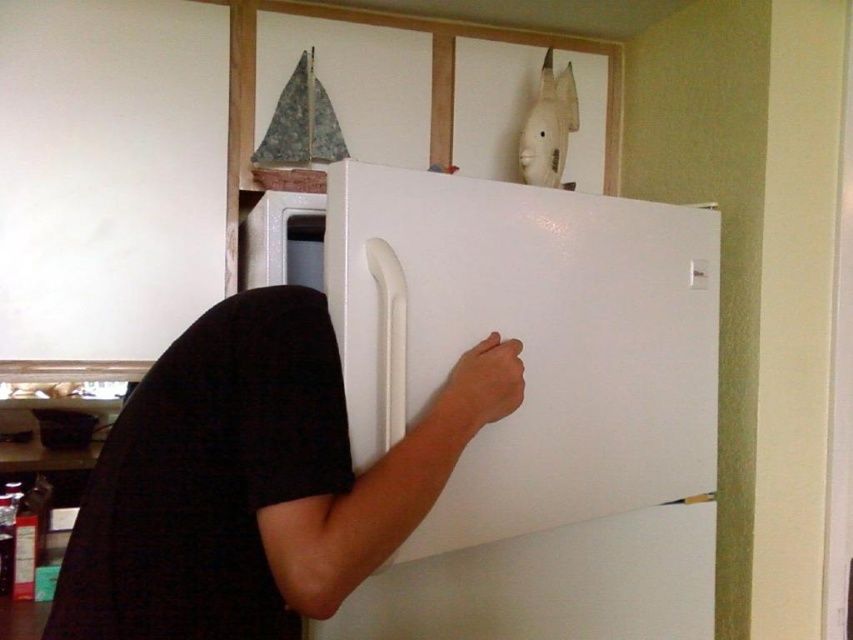
Consider the image. Which is below, white glossy refrigerator at center or black matte shirt at center?

black matte shirt at center is below.

What do you see at coordinates (534, 403) in the screenshot? The width and height of the screenshot is (853, 640). I see `white glossy refrigerator at center` at bounding box center [534, 403].

Measure the distance between white glossy refrigerator at center and camera.

81.17 centimeters

Where is `white glossy refrigerator at center`? white glossy refrigerator at center is located at coordinates (534, 403).